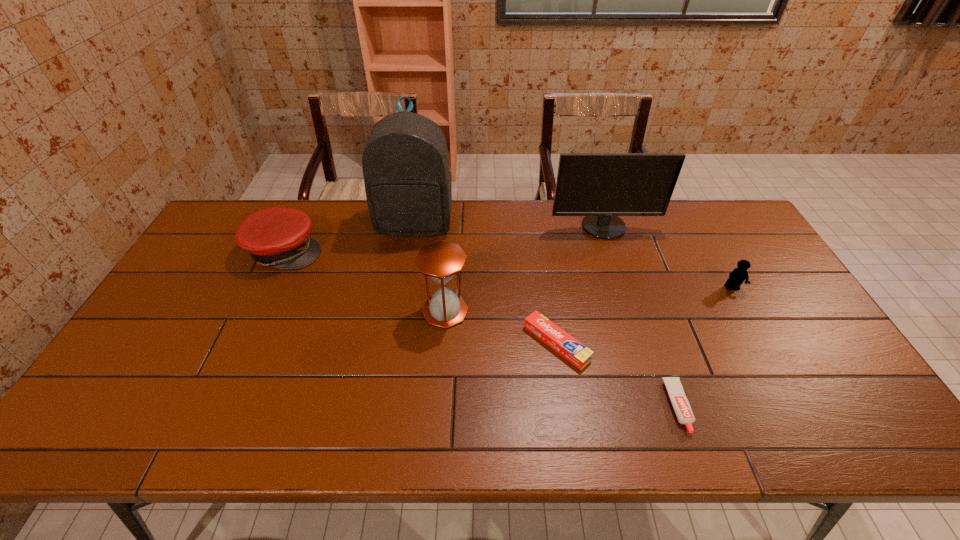
Find the location of a particular element. object that is positioned at the left edge is located at coordinates (278, 237).

The height and width of the screenshot is (540, 960). I want to click on object situated at the right edge, so click(x=738, y=275).

The image size is (960, 540). I want to click on object that is at the far left corner, so click(278, 237).

In the image, there is a desktop. Identify the location of vacant space at the far edge. (347, 202).

In the image, there is a desktop. Identify the location of free space at the near edge. (362, 416).

Locate an element on the screen. This screenshot has height=540, width=960. vacant space at the left edge of the desktop is located at coordinates 130,350.

Find the location of a particular element. Image resolution: width=960 pixels, height=540 pixels. blank space at the right edge is located at coordinates (763, 318).

Where is `unoccupied area between the rightmost object and the cap`? This screenshot has height=540, width=960. unoccupied area between the rightmost object and the cap is located at coordinates (509, 269).

You are a GUI agent. You are given a task and a screenshot of the screen. Output one action in this format:
    pyautogui.click(x=<x>, y=<y>)
    Task: Click on the free space between the monitor and the backpack
    This screenshot has width=960, height=540.
    Given the screenshot: What is the action you would take?
    pyautogui.click(x=510, y=225)

The width and height of the screenshot is (960, 540). What are the coordinates of `vacant area between the hourglass and the rightmost object` in the screenshot? It's located at (588, 300).